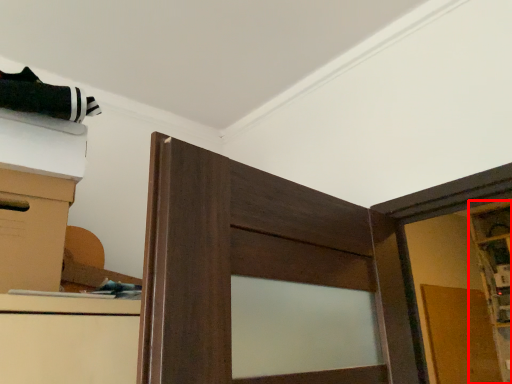
Question: Considering the relative positions of cabinetry (annotated by the red box) and cardboard box in the image provided, where is cabinetry (annotated by the red box) located with respect to the staircase?

Choices:
 (A) right
 (B) left

Answer: (A)